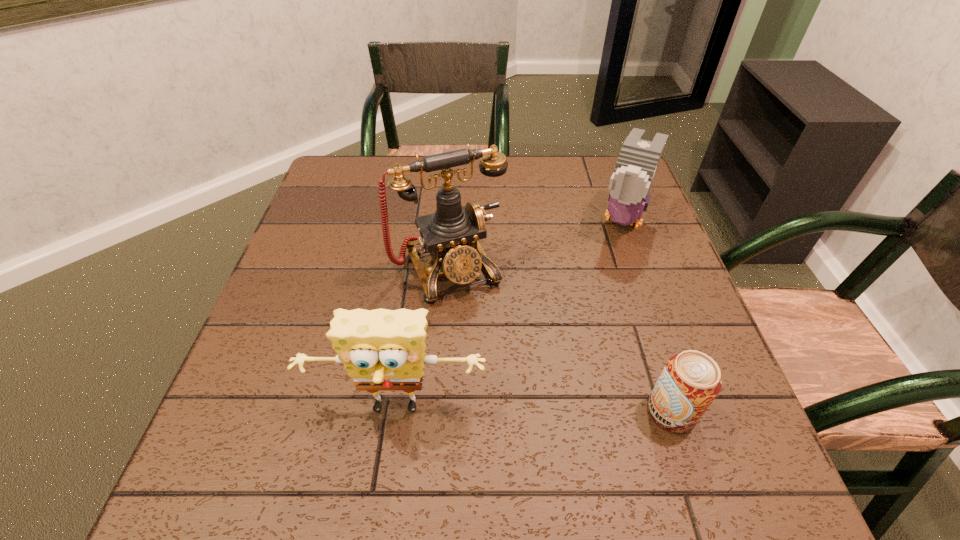
In the image, there is a desktop. Where is `vacant area at the far edge`? This screenshot has height=540, width=960. vacant area at the far edge is located at coordinates (456, 180).

In the image, there is a desktop. Where is `vacant space at the near edge`? vacant space at the near edge is located at coordinates (465, 400).

In the image, there is a desktop. Identify the location of vacant space at the left edge. (309, 251).

Find the location of a particular element. Image resolution: width=960 pixels, height=540 pixels. free space at the right edge is located at coordinates (645, 274).

Identify the location of vacant region at the far left corner of the desktop. The image size is (960, 540). (383, 158).

In order to click on free region at the near left corner of the desktop in this screenshot , I will do `click(286, 400)`.

This screenshot has height=540, width=960. I want to click on free space at the far right corner, so click(x=589, y=172).

Image resolution: width=960 pixels, height=540 pixels. Find the location of `free space between the bird and the beer can`. free space between the bird and the beer can is located at coordinates (646, 315).

This screenshot has width=960, height=540. In order to click on empty space between the bird and the tallest object in this screenshot , I will do `click(536, 244)`.

The image size is (960, 540). Find the location of `vacant point located between the telephone and the bird`. vacant point located between the telephone and the bird is located at coordinates (536, 244).